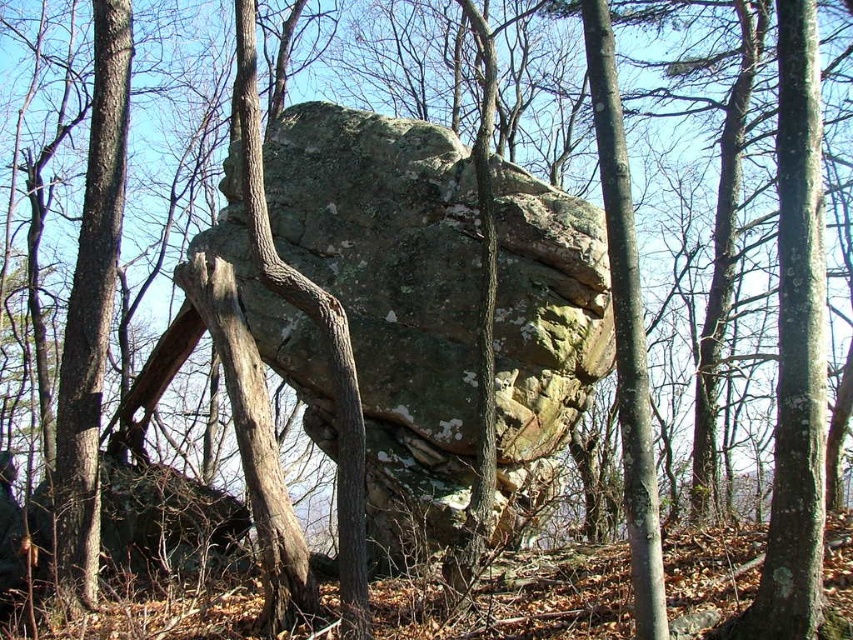
You are standing in the forest scene depicted. There is a point marked at coordinates (392, 298). What object is located at that point?

The point at coordinates (392, 298) corresponds to the lichen covered rock at center.